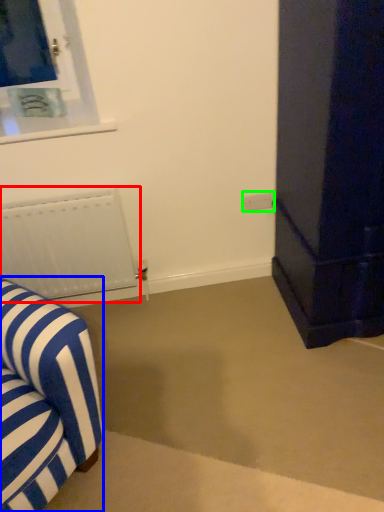
Question: Estimate the real-world distances between objects in this image. Which object is farther from radiator (highlighted by a red box), furniture (highlighted by a blue box) or electric outlet (highlighted by a green box)?

Choices:
 (A) furniture
 (B) electric outlet

Answer: (B)